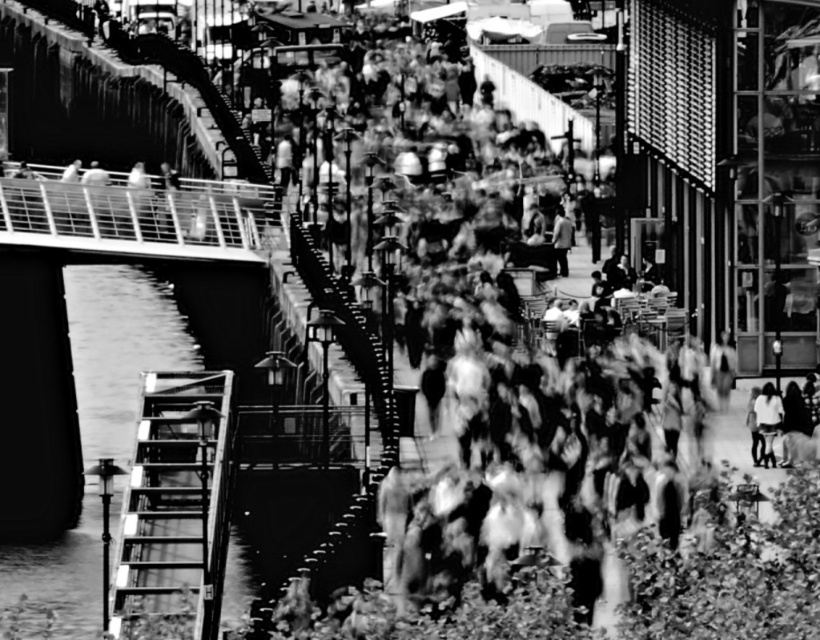
Is metallic ladder at left taller than light gray fabric jacket at lower right?

Yes.

Between metallic ladder at left and light gray fabric jacket at lower right, which one is positioned lower?

metallic ladder at left is lower down.

Identify the location of metallic ladder at left. This screenshot has width=820, height=640. (175, 502).